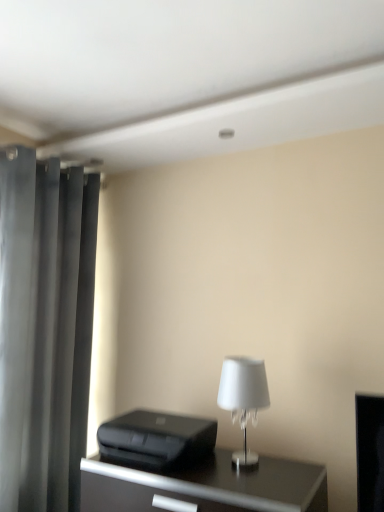
Question: From the image's perspective, relative to dark gray matte curtain at left, is white glass lamp at center above or below?

Choices:
 (A) above
 (B) below

Answer: (B)

Question: Based on their sizes in the image, would you say white glass lamp at center is bigger or smaller than dark gray matte curtain at left?

Choices:
 (A) big
 (B) small

Answer: (B)

Question: Considering the real-world distances, which object is farthest from the white glass lamp at center?

Choices:
 (A) dark gray matte curtain at left
 (B) black plastic printer at lower center
 (C) black glossy table at center

Answer: (A)

Question: Which object is the closest to the black plastic printer at lower center?

Choices:
 (A) black glossy table at center
 (B) white glass lamp at center
 (C) dark gray matte curtain at left

Answer: (A)